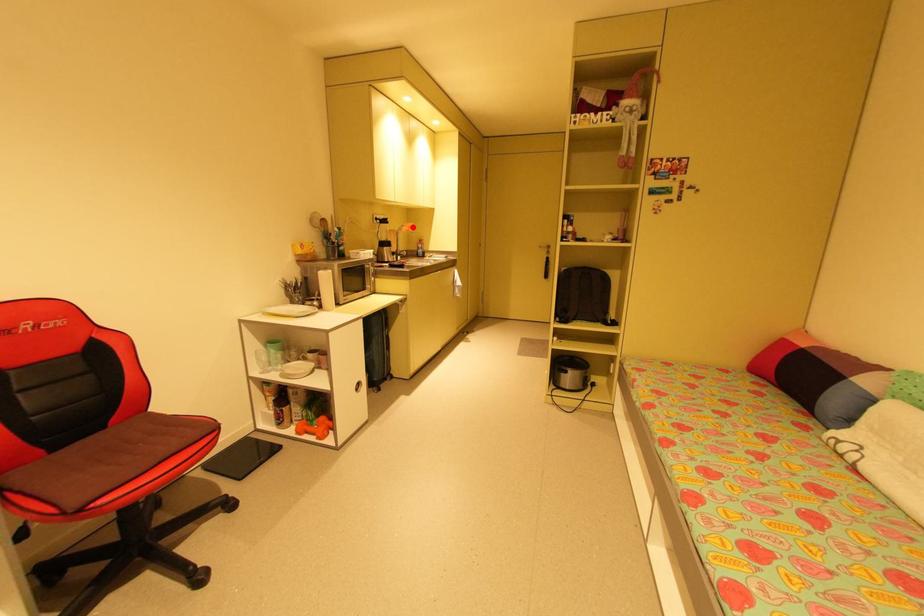
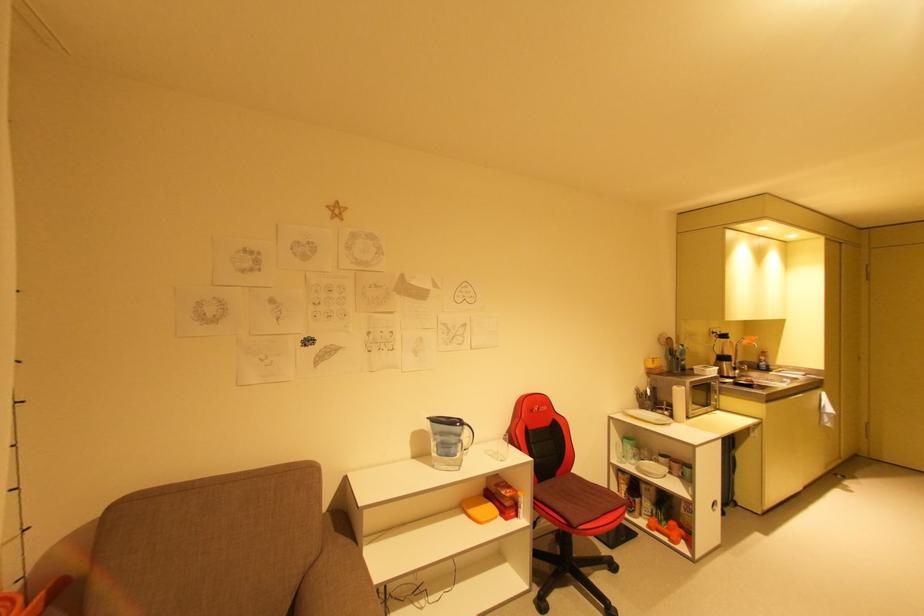
The point at the highlighted location is marked in the first image. Where is the corresponding point in the second image?

(756, 341)